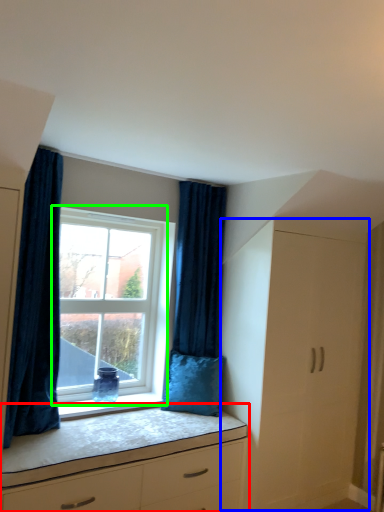
Question: Based on their relative distances, which object is nearer to chest of drawers (highlighted by a red box)? Choose from file cabinet (highlighted by a blue box) and window (highlighted by a green box).

Choices:
 (A) file cabinet
 (B) window

Answer: (A)